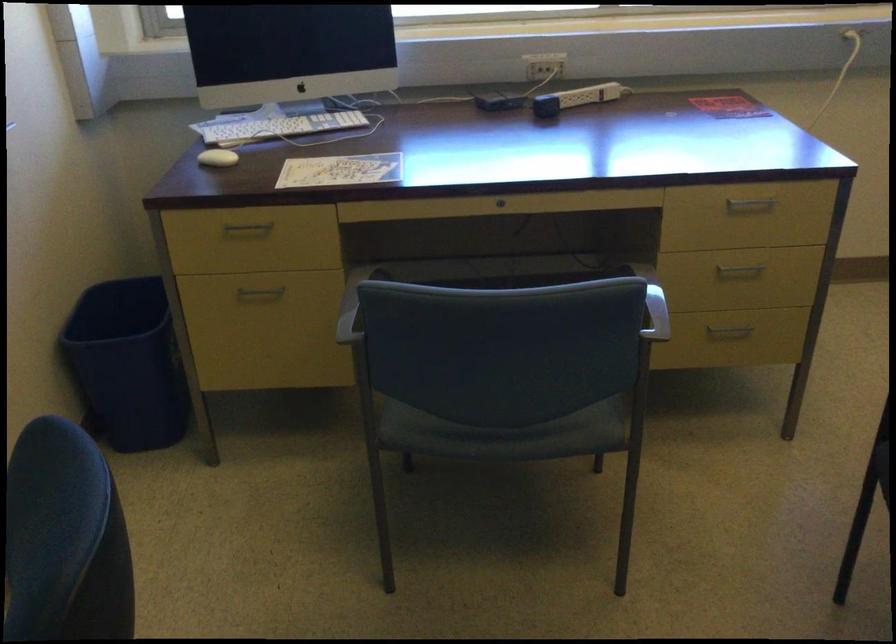
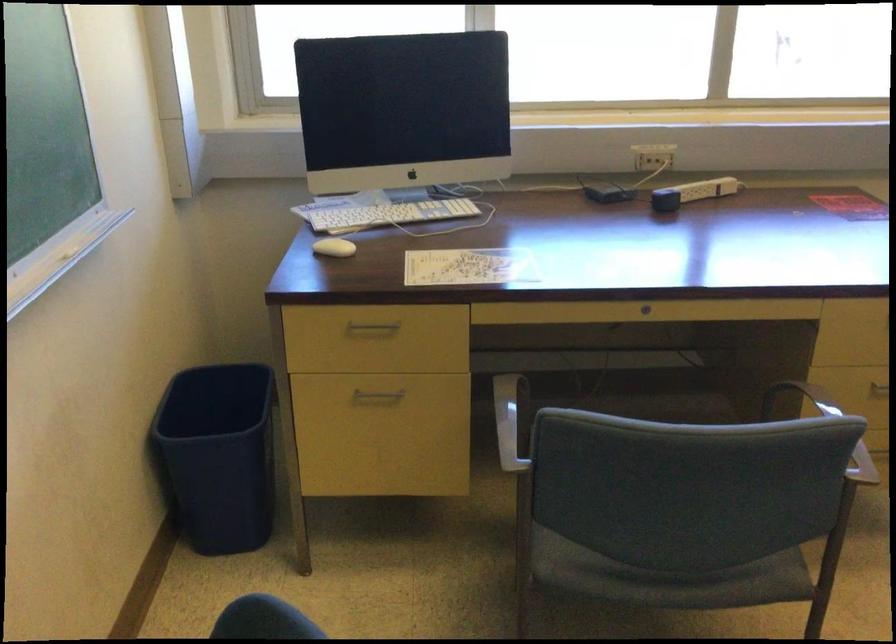
Find the pixel in the second image that matches the point at 502,205 in the first image.

(645, 308)